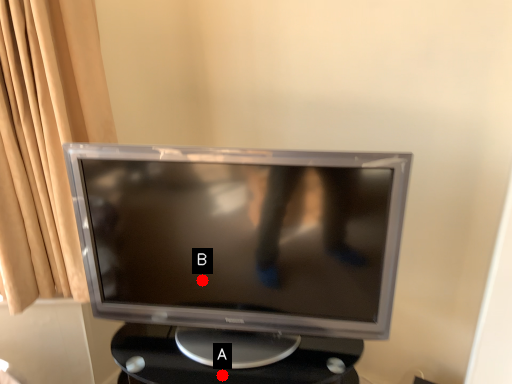
Question: Two points are circled on the image, labeled by A and B beside each circle. Which point is further to the camera?

Choices:
 (A) A is further
 (B) B is further

Answer: (B)